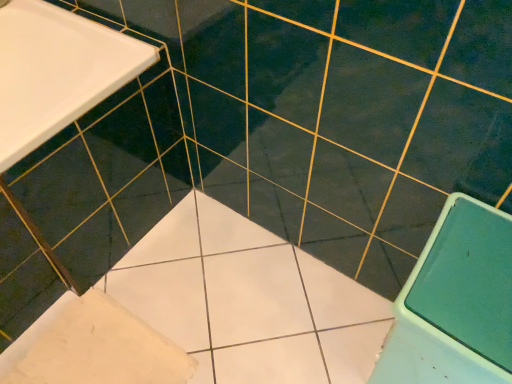
Find the location of `vacant point above white matte tile at center (from a real-world perspective)`. vacant point above white matte tile at center (from a real-world perspective) is located at coordinates (94, 352).